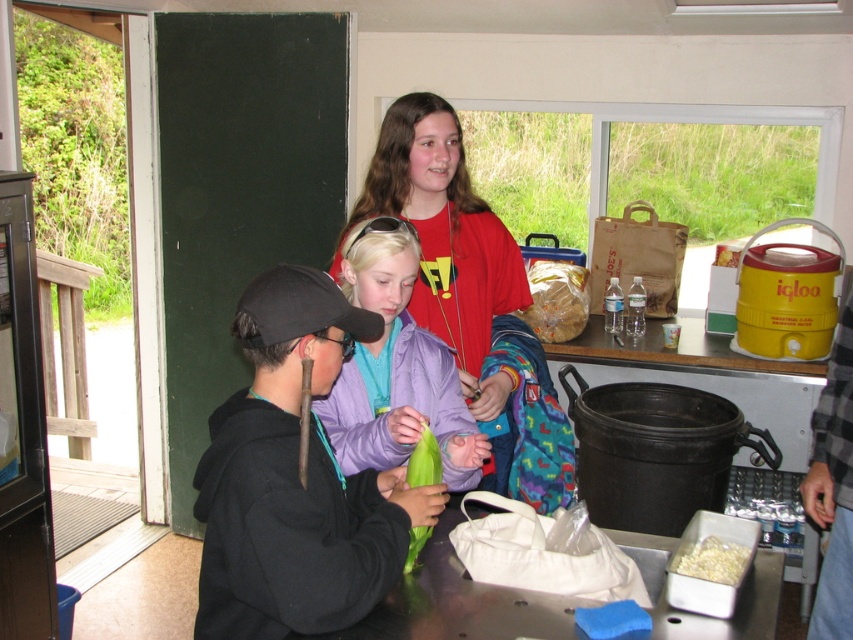
Is purple fabric jacket at center bigger than white matte container at lower right?

Correct, purple fabric jacket at center is larger in size than white matte container at lower right.

Between purple fabric jacket at center and white matte container at lower right, which one is positioned lower?

white matte container at lower right is lower down.

Does point (363, 244) come behind point (694, 518)?

That is True.

The height and width of the screenshot is (640, 853). In order to click on purple fabric jacket at center in this screenshot , I will do `click(396, 372)`.

Between matte red shirt at center and white crumbly food at lower right, which one is positioned lower?

white crumbly food at lower right is lower down.

Which is in front, point (440, 216) or point (682, 560)?

Point (682, 560)

Find the location of `matte red shirt at center`. matte red shirt at center is located at coordinates (468, 292).

Can you confirm if black matte jacket at center is positioned to the right of white crumbly food at lower right?

In fact, black matte jacket at center is to the left of white crumbly food at lower right.

Does black matte jacket at center have a larger size compared to white crumbly food at lower right?

Indeed, black matte jacket at center has a larger size compared to white crumbly food at lower right.

The height and width of the screenshot is (640, 853). What do you see at coordinates (294, 477) in the screenshot? I see `black matte jacket at center` at bounding box center [294, 477].

Identify the location of black matte jacket at center. The image size is (853, 640). pyautogui.click(x=294, y=477).